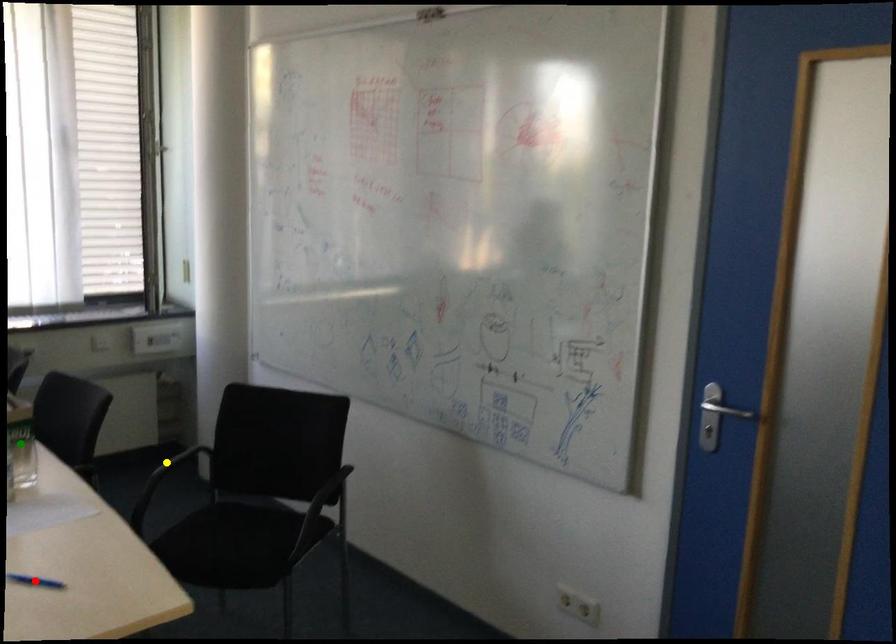
Order these from nearest to farthest:
red point
yellow point
green point

red point
green point
yellow point